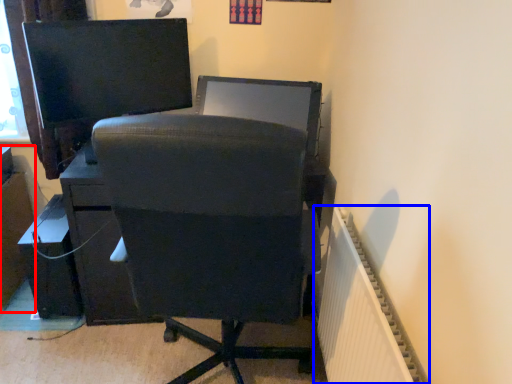
Question: Among these objects, which one is farthest to the camera, file cabinet (highlighted by a red box) or radiator (highlighted by a blue box)?

Choices:
 (A) file cabinet
 (B) radiator

Answer: (A)